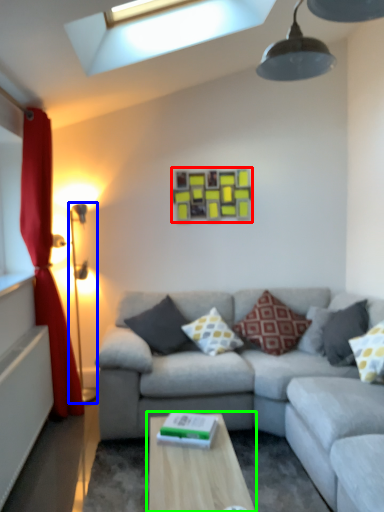
Question: Which is farther away from picture frame (highlighted by a red box)? table lamp (highlighted by a blue box) or table (highlighted by a green box)?

Choices:
 (A) table lamp
 (B) table

Answer: (B)